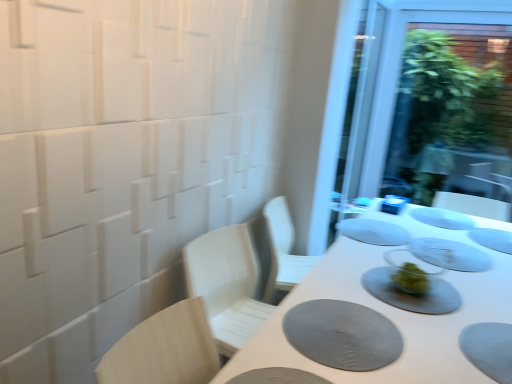
Question: Is gray matte placemat at center, positioned as the 3th tableware in front-to-back order, in front of gray textured placemat at lower right?

Choices:
 (A) yes
 (B) no

Answer: (B)

Question: Does gray matte placemat at center, which is the 4th tableware in back-to-front order, have a lesser height compared to gray textured placemat at lower right?

Choices:
 (A) yes
 (B) no

Answer: (A)

Question: From a real-world perspective, is gray matte placemat at center, positioned as the 3th tableware in front-to-back order, over gray textured placemat at lower right?

Choices:
 (A) no
 (B) yes

Answer: (B)

Question: Is gray matte placemat at center, which is the 4th tableware in back-to-front order, bigger than gray textured placemat at lower right?

Choices:
 (A) no
 (B) yes

Answer: (B)

Question: Is gray matte placemat at center, which is the 4th tableware in back-to-front order, oriented towards gray textured placemat at lower right?

Choices:
 (A) no
 (B) yes

Answer: (A)

Question: Would you say light wood chair at left is to the left or to the right of white matte table at center in the picture?

Choices:
 (A) left
 (B) right

Answer: (A)

Question: From their relative heights in the image, would you say light wood chair at left is taller or shorter than white matte table at center?

Choices:
 (A) short
 (B) tall

Answer: (A)

Question: Is light wood chair at left inside or outside of white matte table at center?

Choices:
 (A) inside
 (B) outside

Answer: (B)

Question: Is light wood chair at left wider or thinner than white matte table at center?

Choices:
 (A) thin
 (B) wide

Answer: (A)

Question: From the image's perspective, is white matte plate at center, the 5th tableware viewed from the front, located above or below light wood chair at left?

Choices:
 (A) below
 (B) above

Answer: (B)

Question: Is white matte plate at center, arranged as the 2th tableware when viewed from the back, wider or thinner than light wood chair at left?

Choices:
 (A) wide
 (B) thin

Answer: (A)

Question: Relative to light wood chair at left, is white matte plate at center, the 5th tableware viewed from the front, in front or behind?

Choices:
 (A) front
 (B) behind

Answer: (B)

Question: Choose the correct answer: Is white matte plate at center, the 5th tableware viewed from the front, inside light wood chair at left or outside it?

Choices:
 (A) inside
 (B) outside

Answer: (B)

Question: From a real-world perspective, is transparent glass screen door at upper right positioned above or below white matte table at center?

Choices:
 (A) below
 (B) above

Answer: (B)

Question: Does point (379, 167) appear closer or farther from the camera than point (429, 332)?

Choices:
 (A) closer
 (B) farther

Answer: (B)